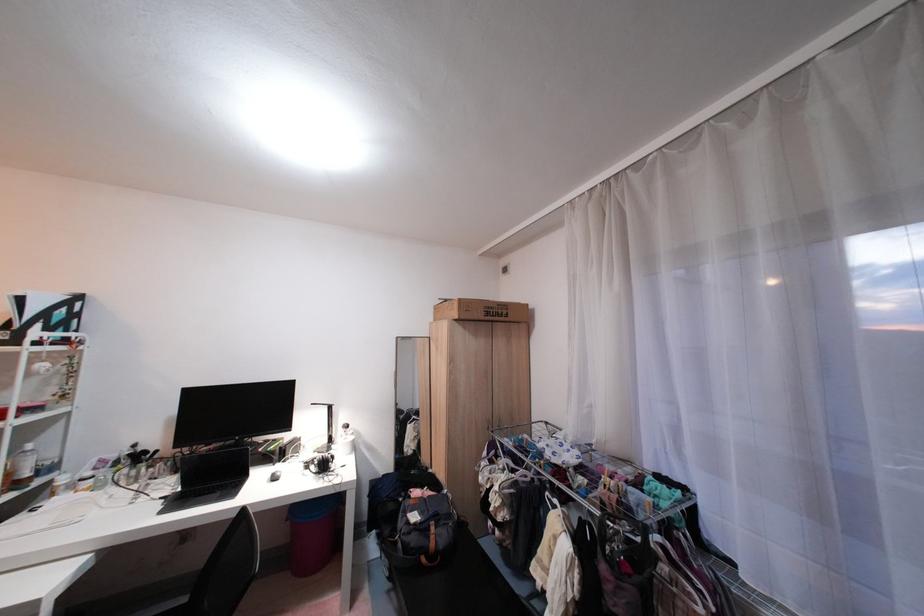
Locate an element on the screen. The image size is (924, 616). brown cardboard box is located at coordinates 480,310.